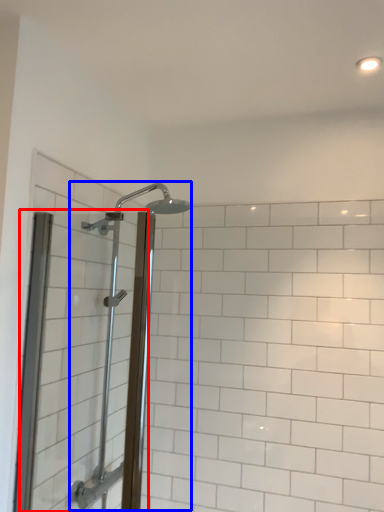
Question: Which object is closer to the camera taking this photo, screen door (highlighted by a red box) or shower (highlighted by a blue box)?

Choices:
 (A) screen door
 (B) shower

Answer: (A)